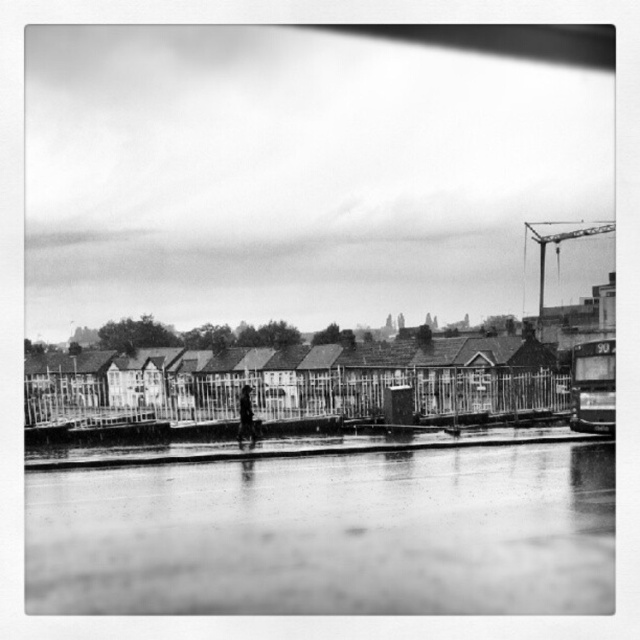
You are a city planner reviewing this urban scene. You need to determine if the distance between the metallic gray crane at upper right and the dark clothing figure at center is sufficient for safe operation. The safety regulation requires at least 100 meters between construction equipment and pedestrians. Is the distance compliant?

The metallic gray crane at upper right and dark clothing figure at center are 111.16 meters apart, which exceeds the 100 meters safety requirement. Therefore, the distance is compliant with the safety regulations.

You are standing at the lower center of the image. There is a wet asphalt flood at lower center. Where exactly is the wet asphalt flood located in terms of coordinates?

The wet asphalt flood at lower center is located at coordinates (330, 534).